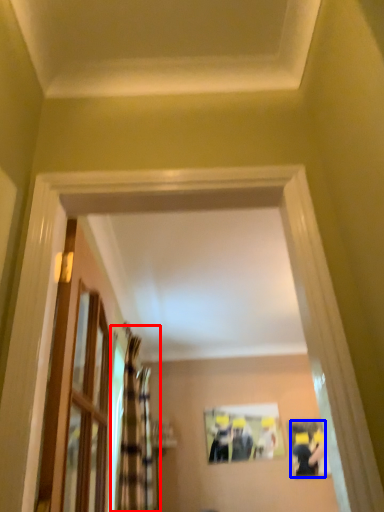
Question: Which point is closer to the camera, curtain (highlighted by a red box) or couple (highlighted by a blue box)?

Choices:
 (A) curtain
 (B) couple

Answer: (A)